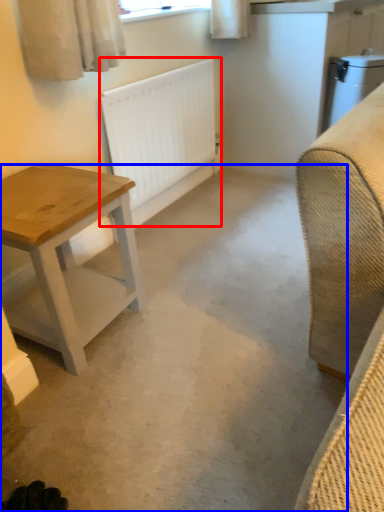
Question: Which of the following is the closest to the observer, radiator (highlighted by a red box) or concrete (highlighted by a blue box)?

Choices:
 (A) radiator
 (B) concrete

Answer: (B)